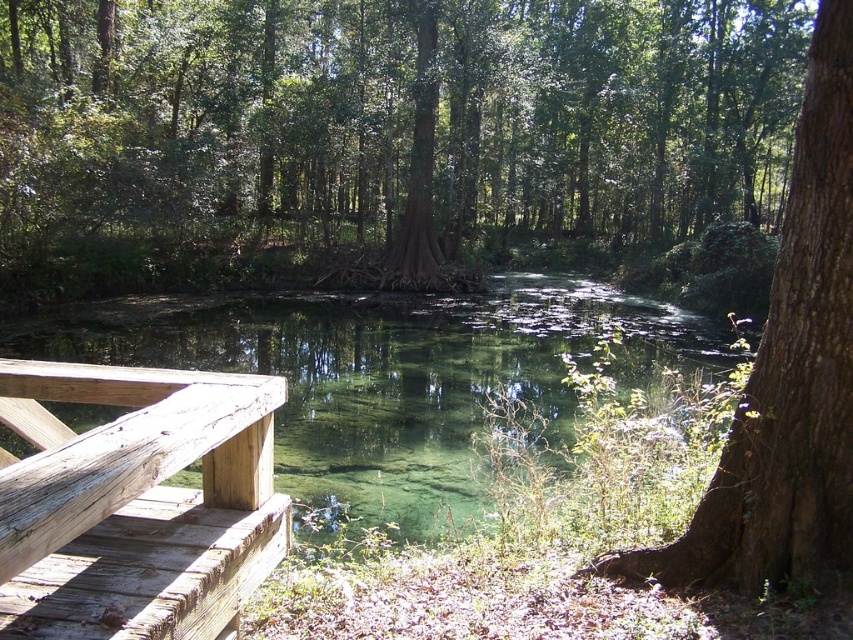
Question: Does clear water stream at center have a larger size compared to weathered wood at left?

Choices:
 (A) no
 (B) yes

Answer: (B)

Question: Which of the following is the farthest from the observer?

Choices:
 (A) clear water stream at center
 (B) weathered wood at left
 (C) green matte tree at center
 (D) brown rough bark tree at right

Answer: (C)

Question: Which point appears farthest from the camera in this image?

Choices:
 (A) (136, 548)
 (B) (86, 323)

Answer: (B)

Question: Among these points, which one is farthest from the camera?

Choices:
 (A) (248, 429)
 (B) (791, 326)
 (C) (541, 285)
 (D) (764, 218)

Answer: (D)

Question: Does green matte tree at center appear on the left side of brown rough bark tree at right?

Choices:
 (A) no
 (B) yes

Answer: (A)

Question: Is green matte tree at center wider than clear water stream at center?

Choices:
 (A) no
 (B) yes

Answer: (B)